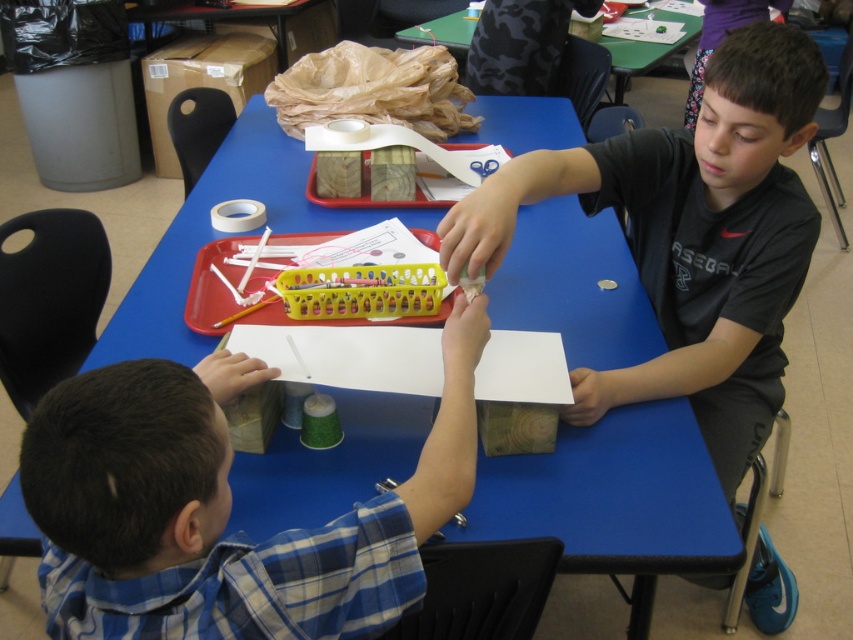
Question: Is brown paper bag at upper center closer to camera compared to green plastic table at upper center?

Choices:
 (A) yes
 (B) no

Answer: (A)

Question: Which point appears farthest from the camera in this image?

Choices:
 (A) (677, 19)
 (B) (399, 51)

Answer: (A)

Question: Does black matte shirt at upper right have a lesser width compared to brown paper bag at upper center?

Choices:
 (A) no
 (B) yes

Answer: (A)

Question: Which object is positioned closest to the brown paper bag at upper center?

Choices:
 (A) black matte shirt at upper right
 (B) blue wood table at center

Answer: (B)

Question: Is blue plaid shirt at lower left bigger than black matte shirt at upper right?

Choices:
 (A) yes
 (B) no

Answer: (B)

Question: Which of the following is the closest to the observer?

Choices:
 (A) (422, 45)
 (B) (703, 288)
 (C) (175, 492)
 (D) (686, 451)

Answer: (C)